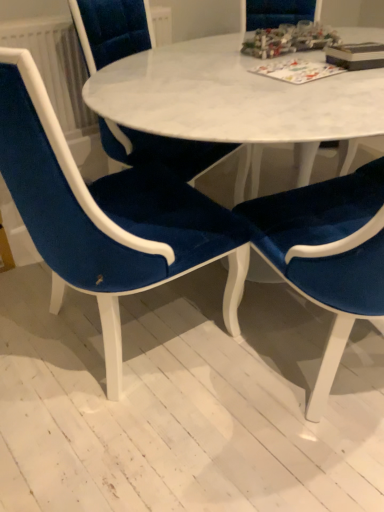
The height and width of the screenshot is (512, 384). In order to click on free spot to the left of velvet blue chair at center, the third chair positioned from the left in this screenshot , I will do `click(203, 390)`.